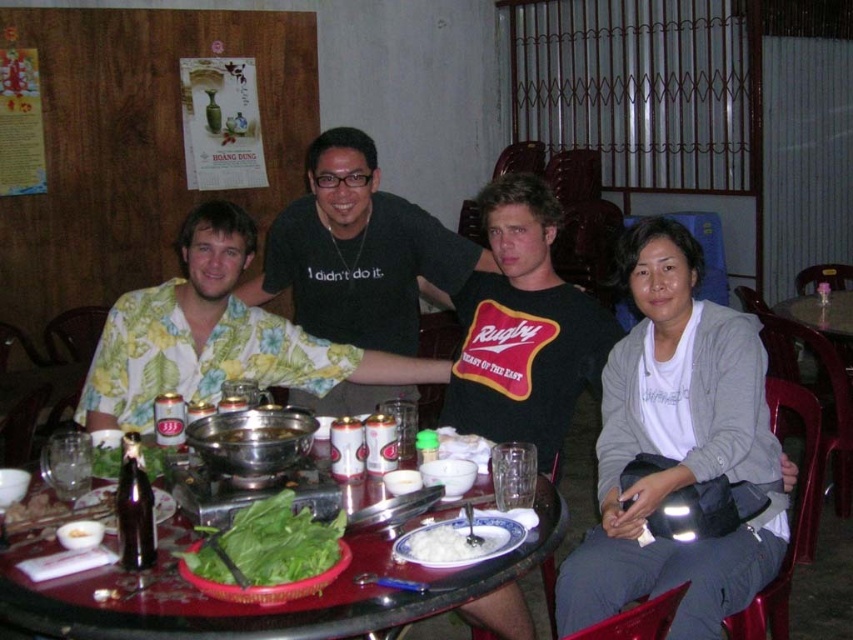
Does white cotton shirt at center appear on the left side of black matte shirt at center?

In fact, white cotton shirt at center is to the right of black matte shirt at center.

In the scene shown: How much distance is there between white cotton shirt at center and black matte shirt at center?

white cotton shirt at center is 87.24 centimeters away from black matte shirt at center.

Which is in front, point (569, 634) or point (341, 316)?

Positioned in front is point (569, 634).

This screenshot has width=853, height=640. I want to click on white cotton shirt at center, so (x=677, y=445).

Who is positioned more to the right, yellow floral shirt at left or green leafy vegetable at center?

Positioned to the right is green leafy vegetable at center.

Does yellow floral shirt at left lie in front of green leafy vegetable at center?

No, yellow floral shirt at left is behind green leafy vegetable at center.

Who is more forward, (90, 406) or (277, 516)?

Positioned in front is point (277, 516).

This screenshot has height=640, width=853. Identify the location of yellow floral shirt at left. (216, 337).

Who is lower down, yellow floral shirt at left or white creamy rice at center?

white creamy rice at center

Where is `yellow floral shirt at left`? Image resolution: width=853 pixels, height=640 pixels. yellow floral shirt at left is located at coordinates (216, 337).

I want to click on yellow floral shirt at left, so click(x=216, y=337).